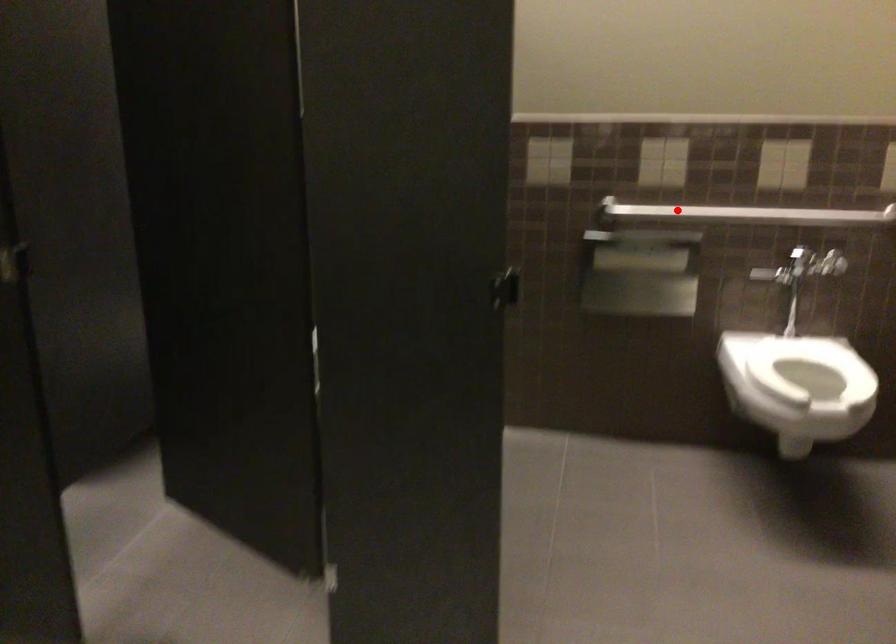
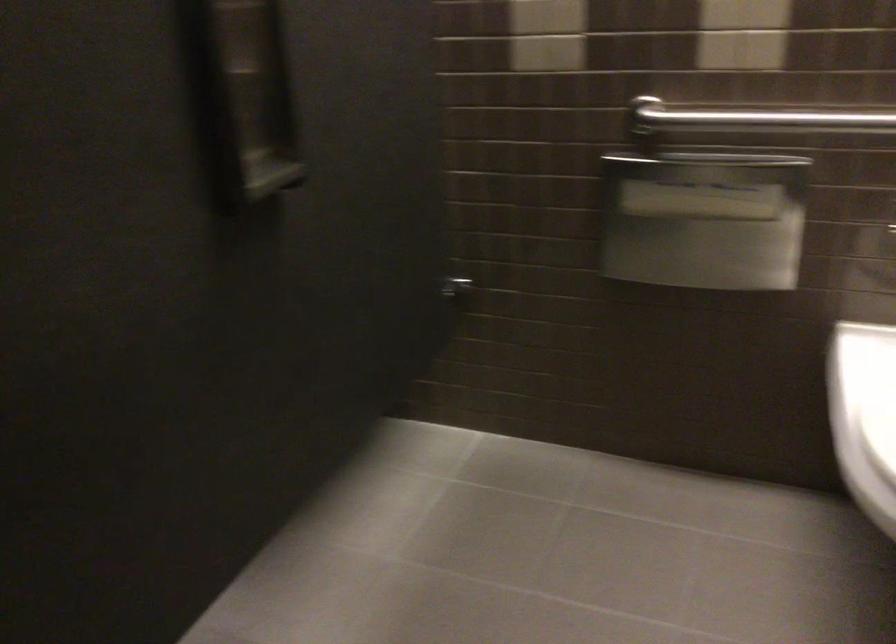
Question: I am providing you with two images of the same scene from different viewpoints. In image1, a red point is highlighted. Considering the same 3D point in image2, which of the following is correct?

Choices:
 (A) It is closer
 (B) It is farther

Answer: (A)